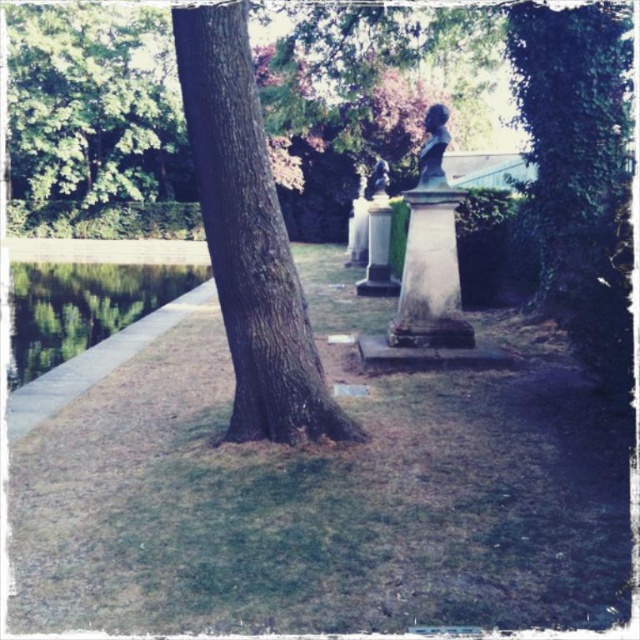
Question: Where is green leafy tree at upper left located in relation to satin bronze bust at upper right in the image?

Choices:
 (A) below
 (B) above

Answer: (B)

Question: Which point is farther from the camera taking this photo?

Choices:
 (A) (308, 392)
 (B) (32, 356)
 (C) (428, 131)
 (D) (38, 32)

Answer: (D)

Question: Is brown rough bark tree at center closer to camera compared to green leafy tree at upper left?

Choices:
 (A) yes
 (B) no

Answer: (A)

Question: Which of the following is the closest to the observer?

Choices:
 (A) (49, 116)
 (B) (433, 163)
 (C) (100, 262)
 (D) (278, 392)

Answer: (D)

Question: Among these points, which one is nearest to the camera?

Choices:
 (A) (234, 221)
 (B) (83, 72)

Answer: (A)

Question: Is green smooth water at lower left closer to the viewer compared to satin bronze bust at upper right?

Choices:
 (A) no
 (B) yes

Answer: (A)